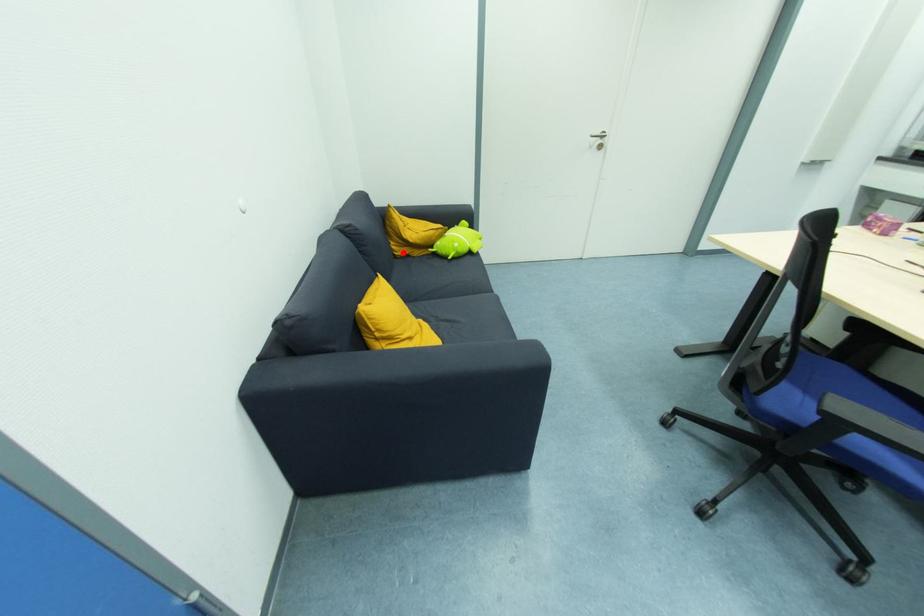
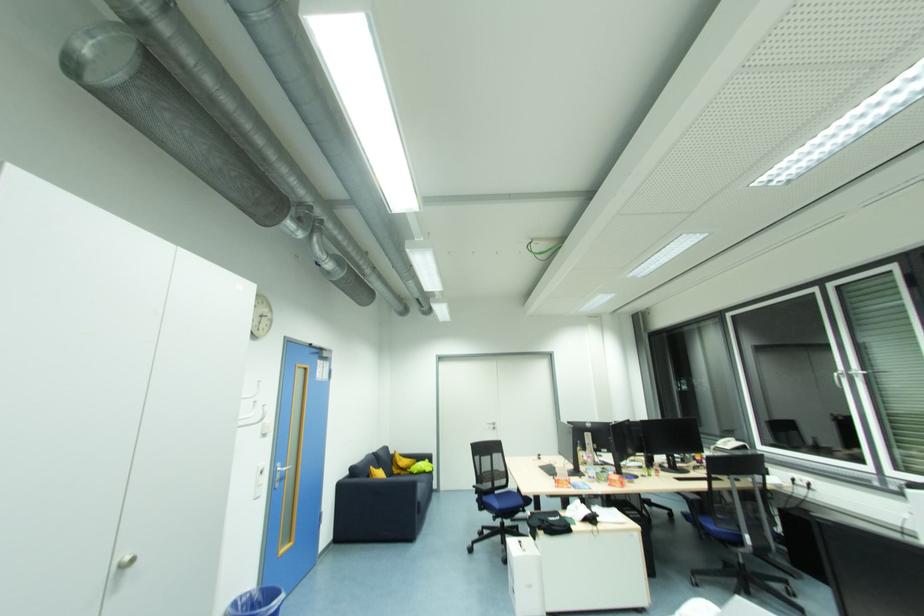
Question: I am providing you with two images of the same scene from different viewpoints. Given a red point in image1, look at the same physical point in image2. Is it:

Choices:
 (A) Closer to the viewpoint
 (B) Farther from the viewpoint

Answer: (B)